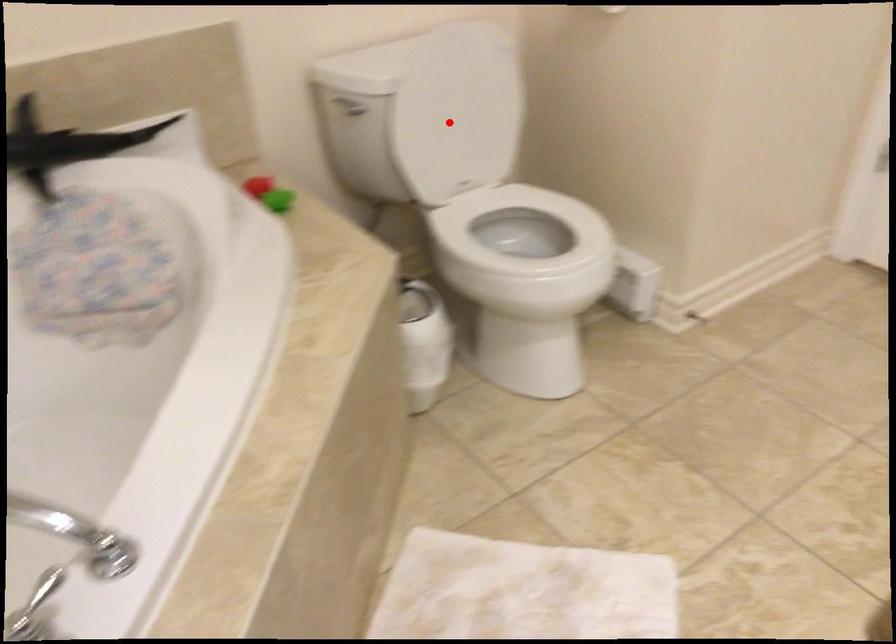
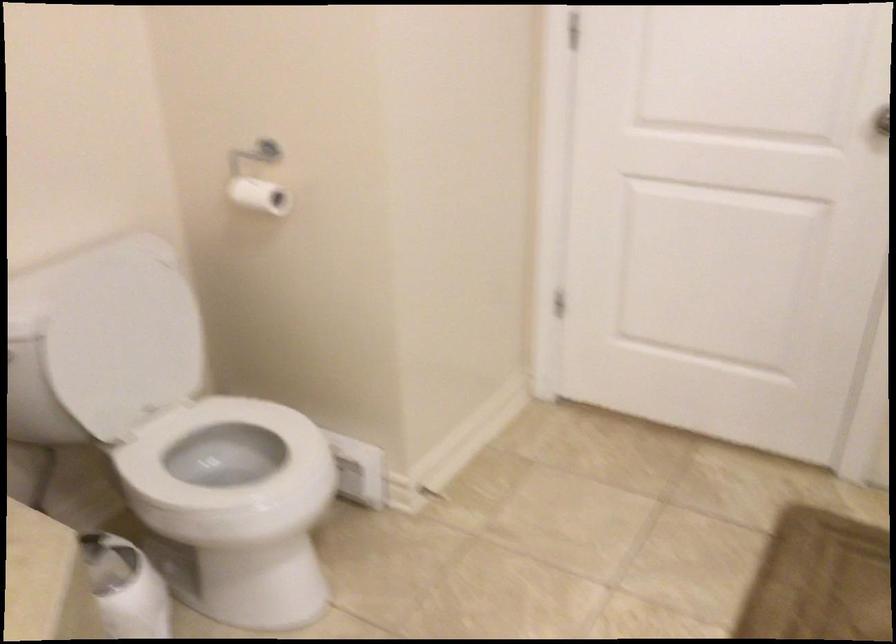
In the second image, find the point that corresponds to the highlighted location in the first image.

(122, 346)